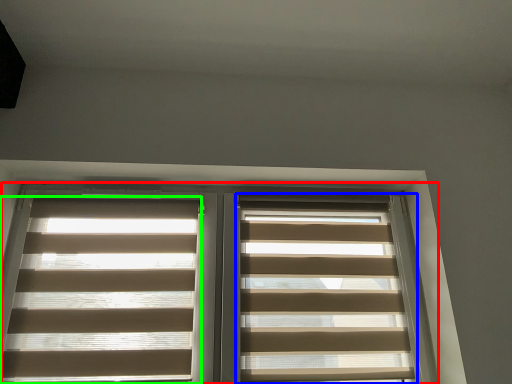
Question: Which object is the closest to the window (highlighted by a red box)? Choose among these: window blind (highlighted by a blue box) or window blind (highlighted by a green box).

Choices:
 (A) window blind
 (B) window blind

Answer: (B)